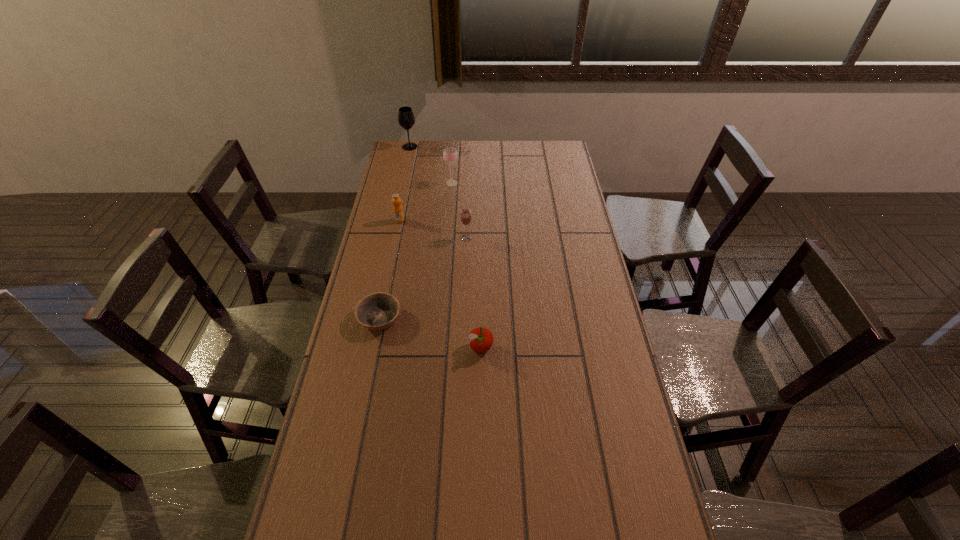
You are a GUI agent. You are given a task and a screenshot of the screen. Output one action in this format:
    pyautogui.click(x=<x>, y=<y>)
    Task: Click on the vacant region that satisfies the following two spatial constraints: 1. on the front label of the third farthest object; 2. on the right side of the fourth farthest object
    This screenshot has height=540, width=960.
    Given the screenshot: What is the action you would take?
    pyautogui.click(x=396, y=238)

Find the location of `vacant region that satisfies the following two spatial constraints: 1. on the front label of the orange juice; 2. on the right side of the nearest object`. vacant region that satisfies the following two spatial constraints: 1. on the front label of the orange juice; 2. on the right side of the nearest object is located at coordinates (374, 348).

I want to click on vacant space that satisfies the following two spatial constraints: 1. on the back side of the second farthest object; 2. on the right side of the bowl, so click(x=407, y=183).

Locate an element on the screen. This screenshot has width=960, height=540. free point that satisfies the following two spatial constraints: 1. on the front side of the apple; 2. on the right side of the fifth farthest object is located at coordinates (373, 348).